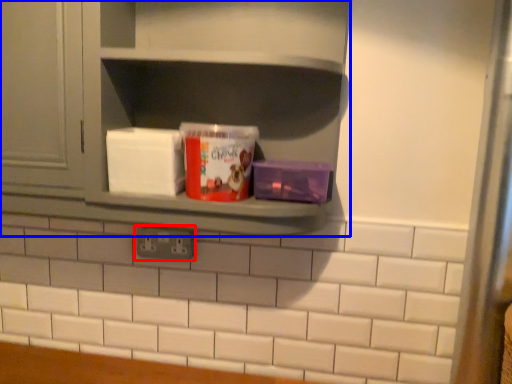
Question: Which object is further to the camera taking this photo, electric outlet (highlighted by a red box) or shelf (highlighted by a blue box)?

Choices:
 (A) electric outlet
 (B) shelf

Answer: (A)